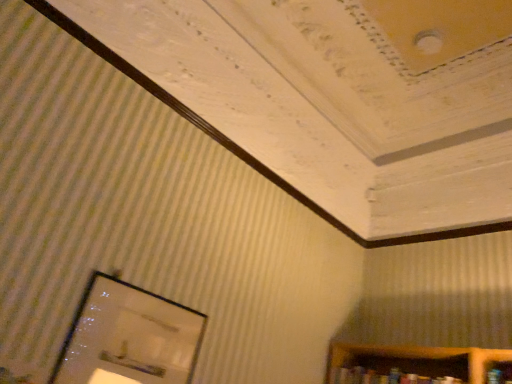
Question: Does matte glass picture frame at lower left have a greater width compared to hardcover book at lower right?

Choices:
 (A) no
 (B) yes

Answer: (A)

Question: From a real-world perspective, is matte glass picture frame at lower left on top of hardcover book at lower right?

Choices:
 (A) yes
 (B) no

Answer: (B)

Question: Does matte glass picture frame at lower left have a lesser height compared to hardcover book at lower right?

Choices:
 (A) no
 (B) yes

Answer: (A)

Question: From the image's perspective, is matte glass picture frame at lower left located above hardcover book at lower right?

Choices:
 (A) yes
 (B) no

Answer: (A)

Question: Would you say hardcover book at lower right is part of matte glass picture frame at lower left's contents?

Choices:
 (A) yes
 (B) no

Answer: (B)

Question: Is matte glass picture frame at lower left next to hardcover book at lower right and touching it?

Choices:
 (A) no
 (B) yes

Answer: (A)

Question: Are hardcover book at lower right and matte glass picture frame at lower left beside each other?

Choices:
 (A) yes
 (B) no

Answer: (B)

Question: Is hardcover book at lower right behind matte glass picture frame at lower left?

Choices:
 (A) yes
 (B) no

Answer: (A)

Question: From a real-world perspective, is hardcover book at lower right under matte glass picture frame at lower left?

Choices:
 (A) yes
 (B) no

Answer: (B)

Question: Is the position of hardcover book at lower right less distant than that of matte glass picture frame at lower left?

Choices:
 (A) yes
 (B) no

Answer: (B)

Question: Is hardcover book at lower right positioned far away from matte glass picture frame at lower left?

Choices:
 (A) no
 (B) yes

Answer: (B)

Question: From the image's perspective, is hardcover book at lower right on matte glass picture frame at lower left?

Choices:
 (A) no
 (B) yes

Answer: (A)

Question: From the image's perspective, is hardcover book at lower right above or below matte glass picture frame at lower left?

Choices:
 (A) above
 (B) below

Answer: (B)